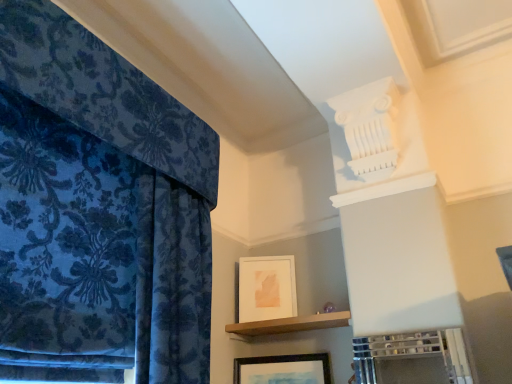
How much space does wooden framed picture at lower center, positioned as the first picture frame in bottom-to-top order, occupy horizontally?

wooden framed picture at lower center, positioned as the first picture frame in bottom-to-top order, is 1.34 inches in width.

How much space does white matte picture frame at upper center, the 2th picture frame when ordered from front to back, occupy horizontally?

white matte picture frame at upper center, the 2th picture frame when ordered from front to back, is 0.89 inches wide.

Find the location of a particular element. This screenshot has height=384, width=512. brown wooden shelf at center is located at coordinates pyautogui.click(x=290, y=324).

The height and width of the screenshot is (384, 512). What are the coordinates of `wooden framed picture at lower center, positioned as the first picture frame in bottom-to-top order` in the screenshot? It's located at (283, 369).

From a real-world perspective, is wooden framed picture at lower center, positioned as the first picture frame in bottom-to-top order, located beneath velvet blue curtain at left?

Indeed, from a real-world perspective, wooden framed picture at lower center, positioned as the first picture frame in bottom-to-top order, is positioned beneath velvet blue curtain at left.

Could you tell me if wooden framed picture at lower center, the second picture frame in the top-to-bottom sequence, is facing velvet blue curtain at left?

No, wooden framed picture at lower center, the second picture frame in the top-to-bottom sequence, is not oriented towards velvet blue curtain at left.

Is wooden framed picture at lower center, positioned as the first picture frame in bottom-to-top order, further to camera compared to velvet blue curtain at left?

Yes.

From the image's perspective, is wooden framed picture at lower center, which is the 2th picture frame in back-to-front order, above velvet blue curtain at left?

No, from the image's perspective, wooden framed picture at lower center, which is the 2th picture frame in back-to-front order, is not on top of velvet blue curtain at left.

Is white matte picture frame at upper center, the first picture frame from the back, positioned in front of brown wooden shelf at center?

No, white matte picture frame at upper center, the first picture frame from the back, is behind brown wooden shelf at center.

Is white matte picture frame at upper center, the first picture frame from the back, positioned with its back to brown wooden shelf at center?

No, white matte picture frame at upper center, the first picture frame from the back,'s orientation is not away from brown wooden shelf at center.

Considering the sizes of white matte picture frame at upper center, the second picture frame ordered from the bottom, and brown wooden shelf at center in the image, is white matte picture frame at upper center, the second picture frame ordered from the bottom, wider or thinner than brown wooden shelf at center?

In the image, white matte picture frame at upper center, the second picture frame ordered from the bottom, appears to be more narrow than brown wooden shelf at center.

Which is more to the right, white matte picture frame at upper center, the second picture frame ordered from the bottom, or brown wooden shelf at center?

brown wooden shelf at center is more to the right.

Is brown wooden shelf at center inside the boundaries of velvet blue curtain at left, or outside?

brown wooden shelf at center lies outside velvet blue curtain at left.

From the image's perspective, who appears lower, brown wooden shelf at center or velvet blue curtain at left?

brown wooden shelf at center.

Is brown wooden shelf at center positioned with its back to velvet blue curtain at left?

brown wooden shelf at center is not turned away from velvet blue curtain at left.

Is brown wooden shelf at center with velvet blue curtain at left?

No, brown wooden shelf at center is not beside velvet blue curtain at left.

Considering the relative sizes of velvet blue curtain at left and white matte picture frame at upper center, the 2th picture frame when ordered from front to back, in the image provided, is velvet blue curtain at left smaller than white matte picture frame at upper center, the 2th picture frame when ordered from front to back,?

Incorrect, velvet blue curtain at left is not smaller in size than white matte picture frame at upper center, the 2th picture frame when ordered from front to back.

Is velvet blue curtain at left to the left or to the right of white matte picture frame at upper center, acting as the 1th picture frame starting from the top, in the image?

Clearly, velvet blue curtain at left is on the left of white matte picture frame at upper center, acting as the 1th picture frame starting from the top, in the image.

Which is less distant, (6,2) or (242,265)?

Point (6,2)

From a real-world perspective, does velvet blue curtain at left sit lower than white matte picture frame at upper center, acting as the 1th picture frame starting from the top?

No.

Considering the points (247, 332) and (245, 308), which point is behind, point (247, 332) or point (245, 308)?

The point (245, 308) is more distant.

Could you tell me if brown wooden shelf at center is facing white matte picture frame at upper center, the second picture frame ordered from the bottom?

No, brown wooden shelf at center is not facing towards white matte picture frame at upper center, the second picture frame ordered from the bottom.

Does brown wooden shelf at center have a greater width compared to white matte picture frame at upper center, the first picture frame from the back?

Indeed, brown wooden shelf at center has a greater width compared to white matte picture frame at upper center, the first picture frame from the back.

How far apart are brown wooden shelf at center and white matte picture frame at upper center, acting as the 1th picture frame starting from the top?

brown wooden shelf at center is 5.66 inches from white matte picture frame at upper center, acting as the 1th picture frame starting from the top.

Consider the image. Relative to velvet blue curtain at left, is white matte picture frame at upper center, the 2th picture frame when ordered from front to back, in front or behind?

white matte picture frame at upper center, the 2th picture frame when ordered from front to back, is positioned farther from the viewer than velvet blue curtain at left.

Is white matte picture frame at upper center, the second picture frame ordered from the bottom, oriented towards velvet blue curtain at left?

No, white matte picture frame at upper center, the second picture frame ordered from the bottom, is not turned towards velvet blue curtain at left.

From a real-world perspective, who is located higher, white matte picture frame at upper center, the 2th picture frame when ordered from front to back, or velvet blue curtain at left?

From a 3D spatial view, velvet blue curtain at left is above.

Are velvet blue curtain at left and wooden framed picture at lower center, which is the 2th picture frame in back-to-front order, far apart?

velvet blue curtain at left is near wooden framed picture at lower center, which is the 2th picture frame in back-to-front order, not far away.

Is velvet blue curtain at left smaller than wooden framed picture at lower center, positioned as the first picture frame in bottom-to-top order?

No.

From a real-world perspective, between velvet blue curtain at left and wooden framed picture at lower center, positioned as the first picture frame in bottom-to-top order, who is vertically higher?

velvet blue curtain at left.

Is velvet blue curtain at left positioned with its back to wooden framed picture at lower center, which is the 2th picture frame in back-to-front order?

No, velvet blue curtain at left is not facing the opposite direction of wooden framed picture at lower center, which is the 2th picture frame in back-to-front order.

Identify the location of curtain above the wooden framed picture at lower center, which is counted as the first picture frame, starting from the front (from a real-world perspective). The image size is (512, 384). (99, 211).

The width and height of the screenshot is (512, 384). What are the coordinates of `the 2nd picture frame behind when counting from the brown wooden shelf at center` in the screenshot? It's located at (267, 288).

Considering their positions, is white matte picture frame at upper center, the first picture frame from the back, positioned closer to brown wooden shelf at center than velvet blue curtain at left?

white matte picture frame at upper center, the first picture frame from the back.

Considering their positions, is brown wooden shelf at center positioned further to wooden framed picture at lower center, the second picture frame in the top-to-bottom sequence, than velvet blue curtain at left?

The object further to wooden framed picture at lower center, the second picture frame in the top-to-bottom sequence, is velvet blue curtain at left.

Estimate the real-world distances between objects in this image. Which object is closer to white matte picture frame at upper center, the first picture frame from the back, wooden framed picture at lower center, the second picture frame in the top-to-bottom sequence, or velvet blue curtain at left?

wooden framed picture at lower center, the second picture frame in the top-to-bottom sequence.

Which object lies further to the anchor point brown wooden shelf at center, white matte picture frame at upper center, acting as the 1th picture frame starting from the top, or wooden framed picture at lower center, positioned as the first picture frame in bottom-to-top order?

wooden framed picture at lower center, positioned as the first picture frame in bottom-to-top order, is positioned further to the anchor brown wooden shelf at center.

Looking at the image, which one is located further to brown wooden shelf at center, velvet blue curtain at left or wooden framed picture at lower center, which is the 2th picture frame in back-to-front order?

velvet blue curtain at left is further to brown wooden shelf at center.

Looking at the image, which one is located closer to wooden framed picture at lower center, the second picture frame in the top-to-bottom sequence, velvet blue curtain at left or brown wooden shelf at center?

brown wooden shelf at center is positioned closer to the anchor wooden framed picture at lower center, the second picture frame in the top-to-bottom sequence.

Based on the photo, looking at the image, which one is located further to velvet blue curtain at left, wooden framed picture at lower center, which is counted as the first picture frame, starting from the front, or brown wooden shelf at center?

wooden framed picture at lower center, which is counted as the first picture frame, starting from the front, lies further to velvet blue curtain at left than the other object.

Based on their spatial positions, is wooden framed picture at lower center, the second picture frame in the top-to-bottom sequence, or white matte picture frame at upper center, the first picture frame from the back, further from brown wooden shelf at center?

wooden framed picture at lower center, the second picture frame in the top-to-bottom sequence, is positioned further to the anchor brown wooden shelf at center.

Identify the location of picture frame that lies between velvet blue curtain at left and wooden framed picture at lower center, the second picture frame in the top-to-bottom sequence, from top to bottom. The height and width of the screenshot is (384, 512). (267, 288).

Find the location of a particular element. shelf between white matte picture frame at upper center, acting as the 1th picture frame starting from the top, and wooden framed picture at lower center, the second picture frame in the top-to-bottom sequence, in the up-down direction is located at coordinates (290, 324).

Locate an element on the screen. This screenshot has height=384, width=512. shelf between velvet blue curtain at left and wooden framed picture at lower center, positioned as the first picture frame in bottom-to-top order, from top to bottom is located at coordinates (290, 324).

This screenshot has width=512, height=384. What are the coordinates of `picture frame between velvet blue curtain at left and brown wooden shelf at center vertically` in the screenshot? It's located at (267, 288).